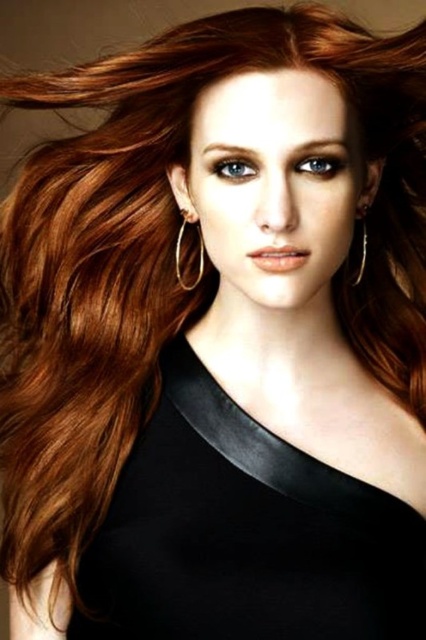
Who is positioned more to the left, black satin dress at center or silver metallic hoop at center?

Positioned to the left is silver metallic hoop at center.

Between black satin dress at center and silver metallic hoop at center, which one has more height?

With more height is black satin dress at center.

The width and height of the screenshot is (426, 640). In order to click on black satin dress at center in this screenshot , I will do `click(244, 534)`.

Does black satin dress at center have a smaller size compared to gold metallic hoop at upper left?

No, black satin dress at center is not smaller than gold metallic hoop at upper left.

Does black satin dress at center have a lesser height compared to gold metallic hoop at upper left?

No.

Is point (296, 451) more distant than point (359, 268)?

No, it is in front of (359, 268).

Locate an element on the screen. Image resolution: width=426 pixels, height=640 pixels. black satin dress at center is located at coordinates (244, 534).

Identify the location of silver metallic hoop at center. This screenshot has height=640, width=426. (180, 257).

From the picture: Which is above, silver metallic hoop at center or gold metallic hoop at upper left?

silver metallic hoop at center is higher up.

Image resolution: width=426 pixels, height=640 pixels. Describe the element at coordinates (180, 257) in the screenshot. I see `silver metallic hoop at center` at that location.

Where is `silver metallic hoop at center`? Image resolution: width=426 pixels, height=640 pixels. silver metallic hoop at center is located at coordinates (180, 257).